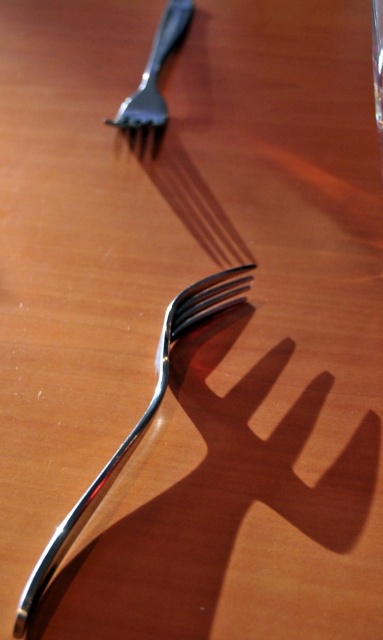
Looking at this image, you are trying to place a small sticker exactly at the point marked by coordinates point (x=137, y=420) on the polished metal fork at center. However, you need to ensure that the sticker won t interfere with the fork s tines. Can you confirm if the point is located on the handle or the tines of the polished metal fork at center?

The point (x=137, y=420) is on the polished metal fork at center, so the sticker will be placed on the handle since the tines are the pointed ends and the handle is the flat part where the point is located.

You are arranging utensils on a table and need to place a napkin between the polished metal fork at center and the satin finish fork at upper left. Based on their positions, where should you place the napkin so it is between them?

The polished metal fork at center is closer to the viewer than the satin finish fork at upper left, so you should place the napkin between them on the table surface, closer to the satin finish fork at upper left to maintain the spatial relationship.